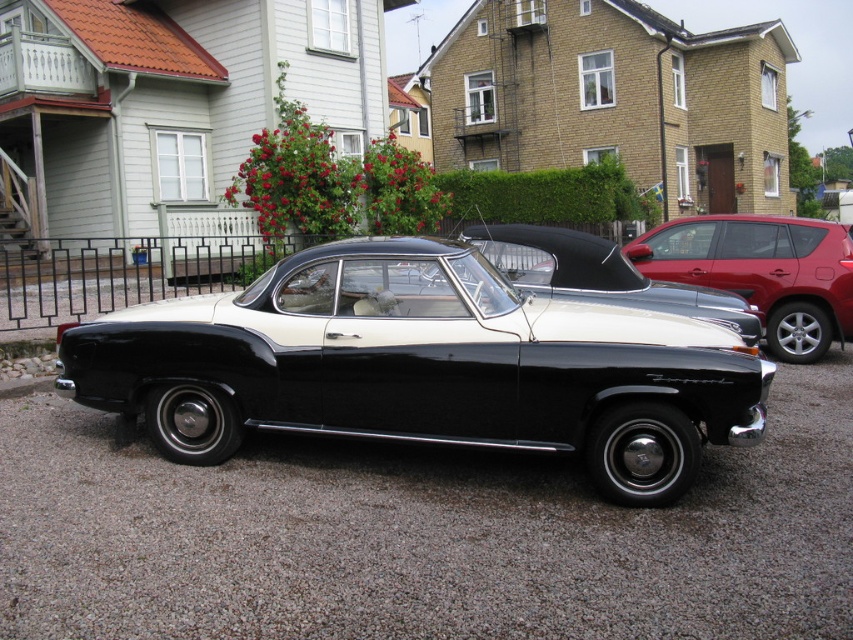
In the scene shown: Is black glossy car at center closer to the viewer compared to glossy red suv at right?

Yes, it is.

At what (x,y) coordinates should I click in order to perform the action: click on black glossy car at center. Please return your answer as a coordinate pair (x, y). Looking at the image, I should click on (424, 365).

Who is more distant from viewer, (303, 257) or (672, 234)?

The point (672, 234) is more distant.

Where is `black glossy car at center`? This screenshot has width=853, height=640. black glossy car at center is located at coordinates (424, 365).